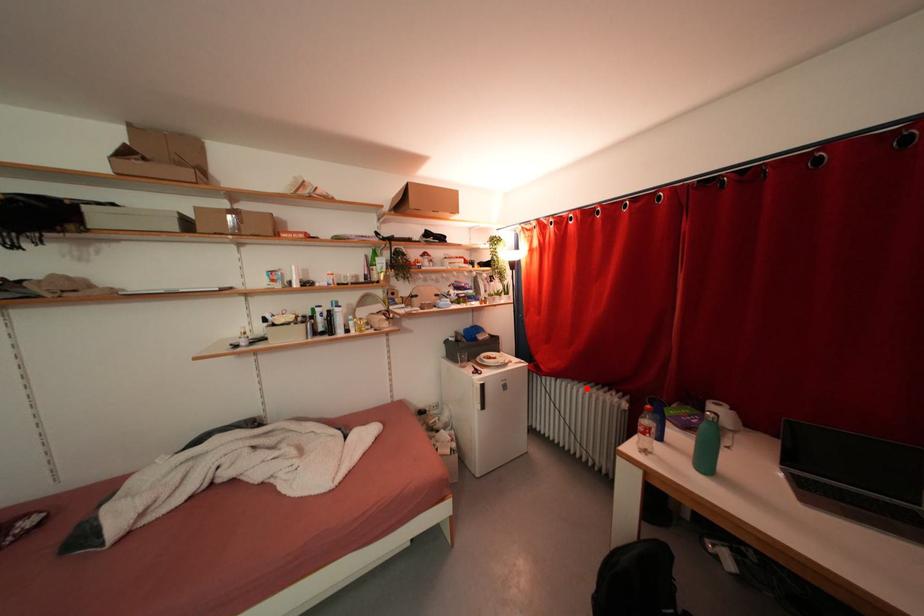
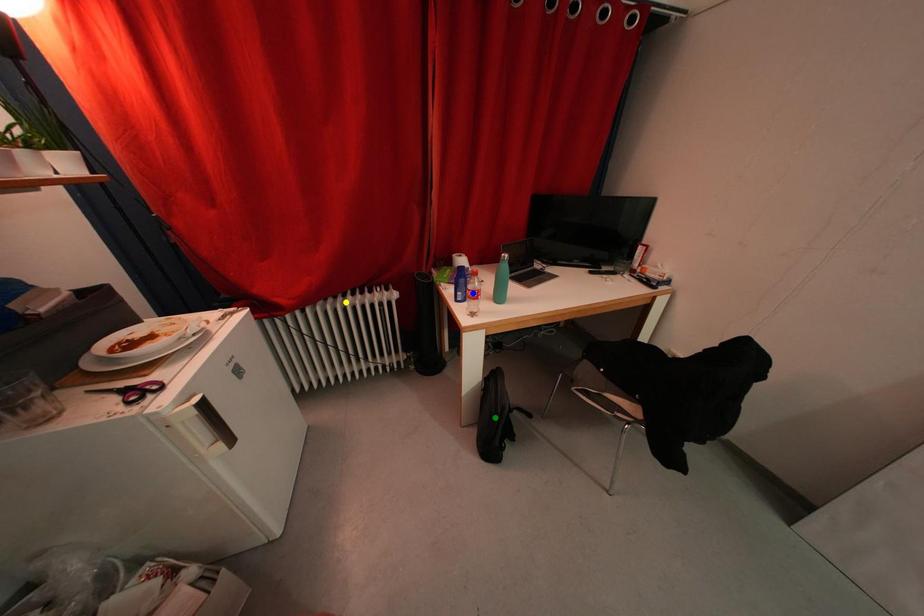
Question: I am providing you with two images of the same scene from different viewpoints. A red point is marked on the first image. You are given multiple points on the second image. In image 2, which mark is for the same physical point as the one in image 1?

Choices:
 (A) blue point
 (B) yellow point
 (C) green point

Answer: (B)